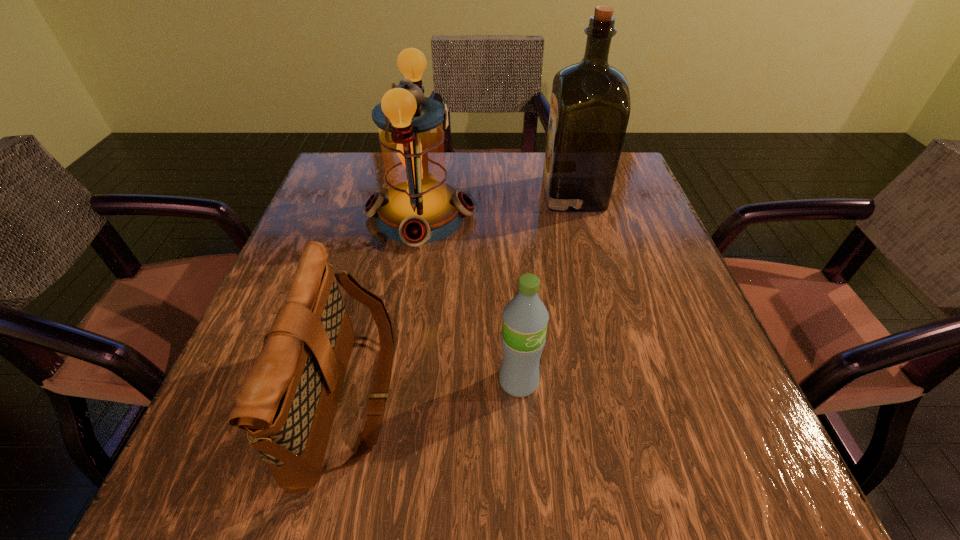
This screenshot has width=960, height=540. Identify the location of blank space located on the front-facing side of the shoulder bag. (503, 398).

Find the location of a particular element. Image resolution: width=960 pixels, height=540 pixels. liquor that is at the far edge is located at coordinates (590, 106).

Where is `lantern at the far edge`? This screenshot has height=540, width=960. lantern at the far edge is located at coordinates (x=418, y=207).

Where is `object that is at the near edge`? object that is at the near edge is located at coordinates (287, 403).

This screenshot has width=960, height=540. In order to click on lantern at the left edge in this screenshot , I will do 418,207.

Identify the location of shoulder bag at the left edge. (287, 403).

The image size is (960, 540). Identify the location of object that is at the right edge. (590, 106).

Image resolution: width=960 pixels, height=540 pixels. In order to click on object that is at the far left corner in this screenshot , I will do `click(418, 207)`.

I want to click on object that is positioned at the near left corner, so click(x=287, y=403).

The image size is (960, 540). In order to click on object present at the far right corner in this screenshot , I will do `click(590, 106)`.